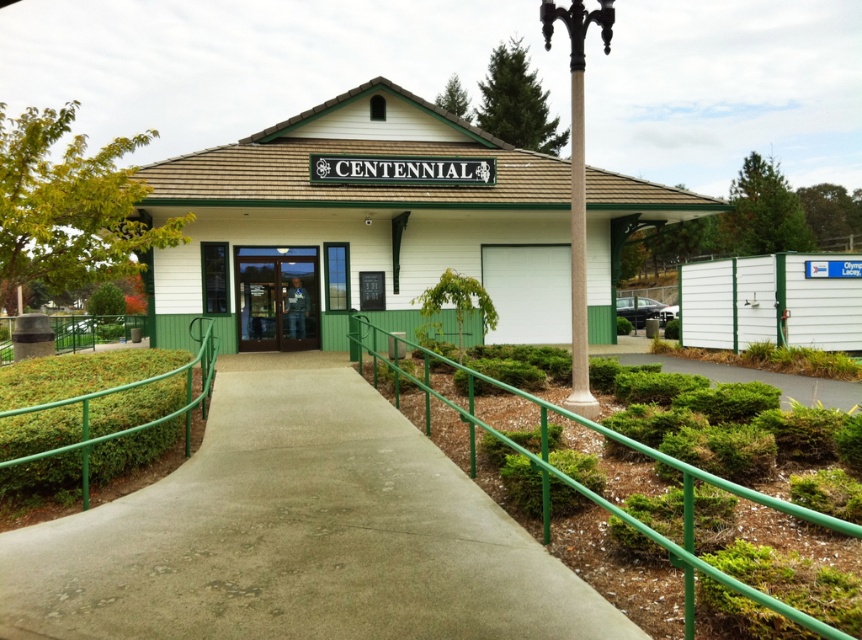
Does point (811, 627) come behind point (272, 304)?

No, it is in front of (272, 304).

Who is more distant from viewer, (372, 344) or (234, 252)?

Positioned behind is point (234, 252).

Identify the location of green metal railing at center. Image resolution: width=862 pixels, height=640 pixels. (742, 554).

Which is below, green metallic railing at center or transparent glass door at center?

green metallic railing at center is below.

Is green metallic railing at center shorter than transparent glass door at center?

Yes.

This screenshot has height=640, width=862. What do you see at coordinates (92, 417) in the screenshot? I see `green metallic railing at center` at bounding box center [92, 417].

I want to click on green metallic railing at center, so click(x=92, y=417).

Who is shorter, concrete at center or green metallic railing at center?

Standing shorter between the two is concrete at center.

Is concrete at center behind green metallic railing at center?

No, concrete at center is in front of green metallic railing at center.

The image size is (862, 640). Describe the element at coordinates (297, 532) in the screenshot. I see `concrete at center` at that location.

The width and height of the screenshot is (862, 640). I want to click on concrete at center, so click(x=297, y=532).